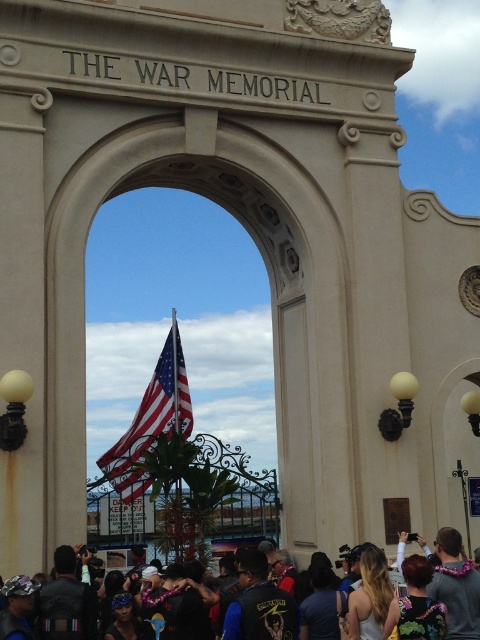
Question: Where is dark gray leather jackets at lower center located in relation to dark blue shirt at center in the image?

Choices:
 (A) right
 (B) left

Answer: (A)

Question: Which of the following is the farthest from the observer?

Choices:
 (A) (168, 380)
 (B) (250, 548)

Answer: (A)

Question: Is dark blue leather jacket at center below dark brown leather jacket at lower right?

Choices:
 (A) yes
 (B) no

Answer: (A)

Question: Which of the following is the closest to the observer?

Choices:
 (A) blonde hair at center
 (B) dark blue shirt at center
 (C) dark brown leather jacket at lower right
 (D) dark blue leather jacket at center

Answer: (C)

Question: Is polished metallic flag at center further to the viewer compared to dark gray leather jackets at lower center?

Choices:
 (A) no
 (B) yes

Answer: (B)

Question: Among these objects, which one is farthest from the camera?

Choices:
 (A) blonde hair at center
 (B) polished metallic flag at center
 (C) leather jacket at lower left

Answer: (B)